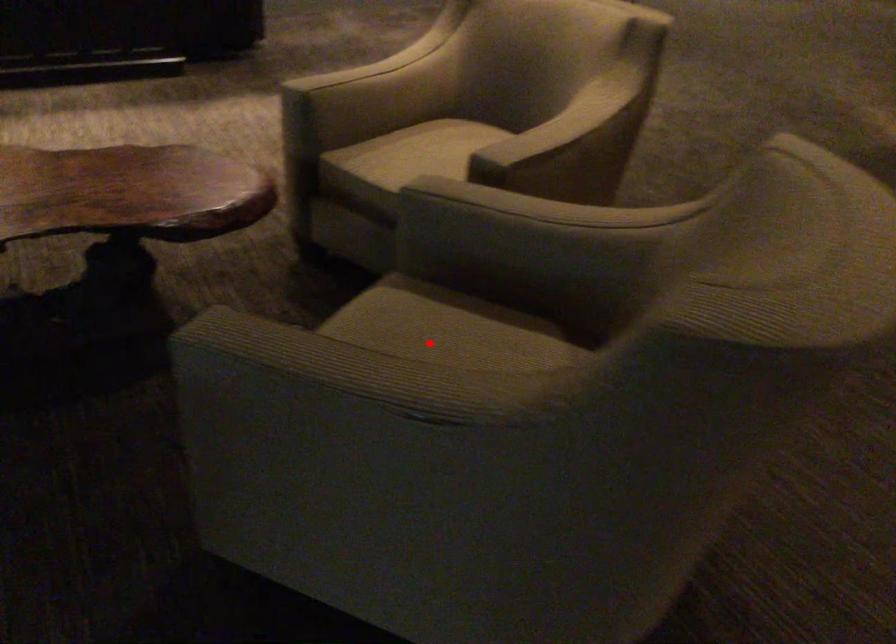
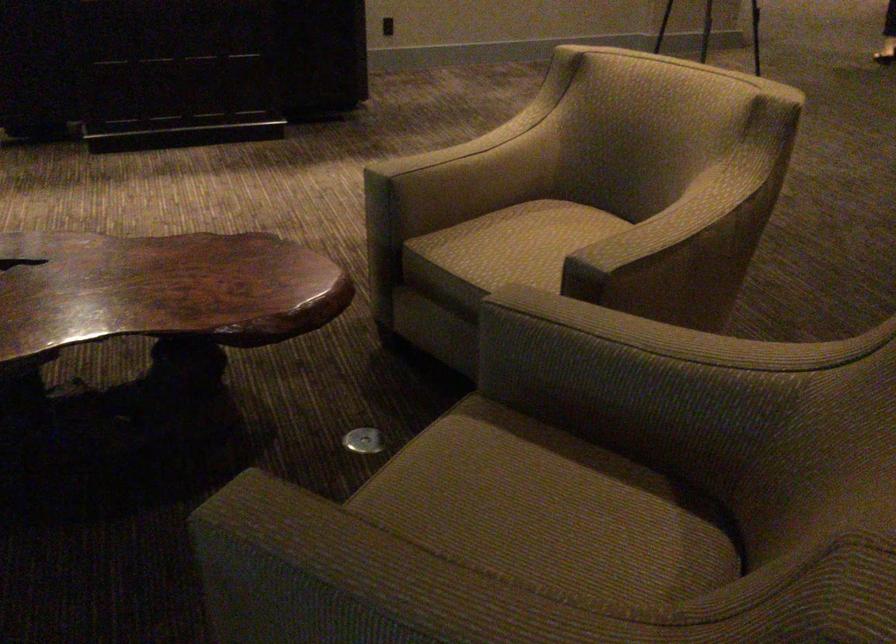
Question: I am providing you with two images of the same scene from different viewpoints. Image1 has a red point marked. In image2, the corresponding 3D location appears at what relative position? Reply with the corresponding letter.

Choices:
 (A) Closer
 (B) Farther

Answer: (A)